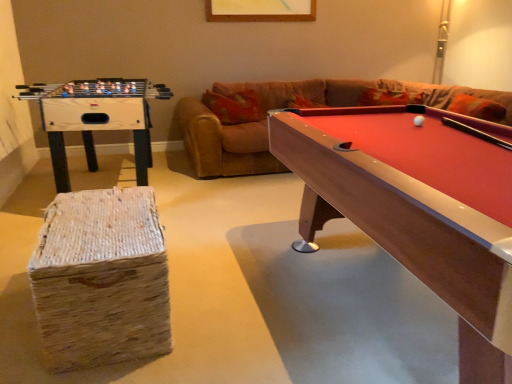
Question: Looking at their shapes, would you say rubberized wood billiard table at right is wider or thinner than woven straw stool at lower left?

Choices:
 (A) wide
 (B) thin

Answer: (A)

Question: From the image's perspective, is rubberized wood billiard table at right located above or below woven straw stool at lower left?

Choices:
 (A) below
 (B) above

Answer: (B)

Question: Which of these objects is positioned closest to the white matte ball at center-right?

Choices:
 (A) wooden foosball table at left
 (B) leather couch at upper right
 (C) rubberized wood billiard table at right
 (D) woven straw stool at lower left

Answer: (C)

Question: Which of these objects is positioned farthest from the white matte ball at center-right?

Choices:
 (A) woven straw stool at lower left
 (B) wooden foosball table at left
 (C) leather couch at upper right
 (D) rubberized wood billiard table at right

Answer: (C)